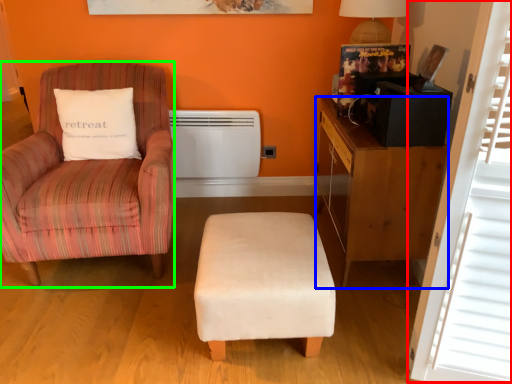
Question: Estimate the real-world distances between objects in this image. Which object is farther from window screen (highlighted by a red box), desk (highlighted by a blue box) or chair (highlighted by a green box)?

Choices:
 (A) desk
 (B) chair

Answer: (B)